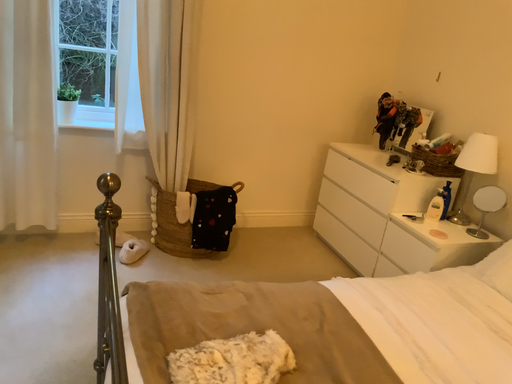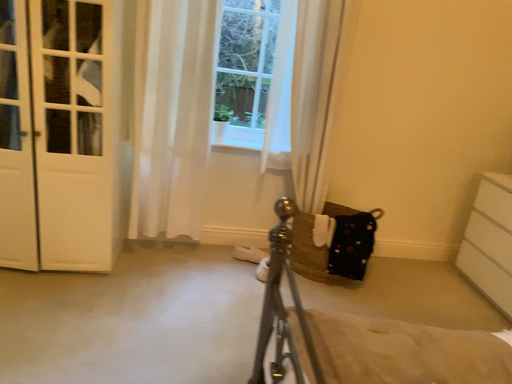
Question: Which way did the camera rotate in the video?

Choices:
 (A) rotated right
 (B) rotated left

Answer: (B)